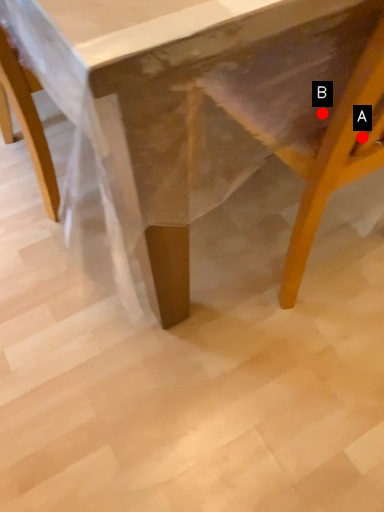
Question: Two points are circled on the image, labeled by A and B beside each circle. Which of the following is the closest to the observer?

Choices:
 (A) A is closer
 (B) B is closer

Answer: (A)